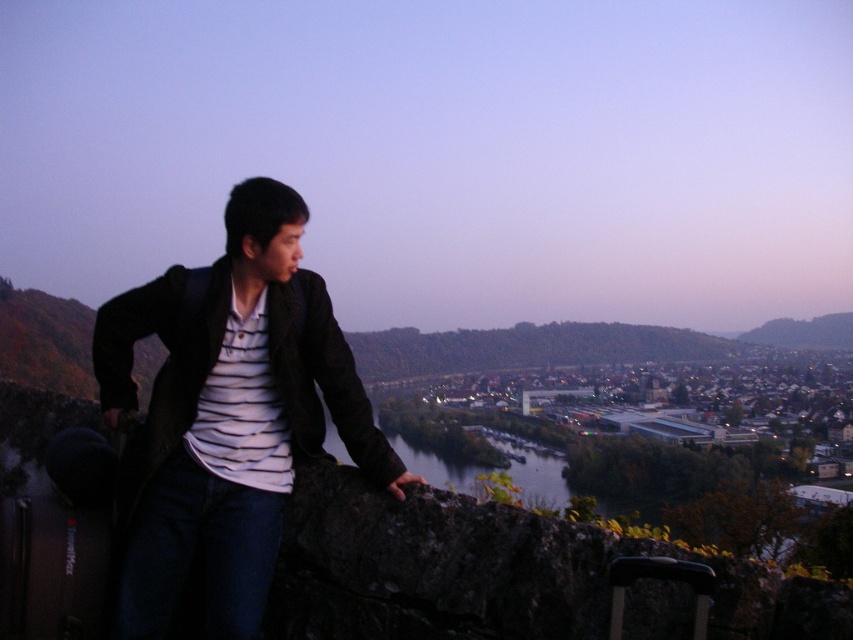
Is matte black jacket at left shorter than dark water at center?

Indeed, matte black jacket at left has a lesser height compared to dark water at center.

Who is positioned more to the right, matte black jacket at left or dark water at center?

dark water at center is more to the right.

Who is more distant from viewer, (x=114, y=323) or (x=444, y=486)?

The point (x=444, y=486) is behind.

Identify the location of matte black jacket at left. (164, 360).

Is white striped shirt at center taller than dark water at center?

Incorrect, white striped shirt at center's height is not larger of dark water at center's.

Who is lower down, white striped shirt at center or dark water at center?

dark water at center

Is point (206, 404) closer to viewer compared to point (553, 465)?

Yes, point (206, 404) is in front of point (553, 465).

At what (x,y) coordinates should I click in order to perform the action: click on white striped shirt at center. Please return your answer as a coordinate pair (x, y). Image resolution: width=853 pixels, height=640 pixels. Looking at the image, I should click on (242, 408).

Does point (173, 403) lie in front of point (206, 465)?

That is False.

Between point (350, 362) and point (221, 374), which one is positioned in front?

Positioned in front is point (221, 374).

Where is `matte black jacket at left`? Image resolution: width=853 pixels, height=640 pixels. matte black jacket at left is located at coordinates [164, 360].